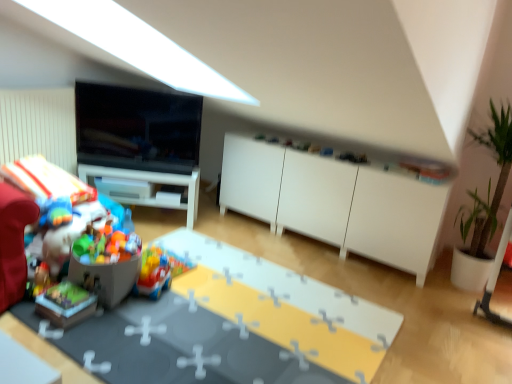
Locate an element on the screen. The height and width of the screenshot is (384, 512). free space on the front side of white matte cabinet at center is located at coordinates (360, 281).